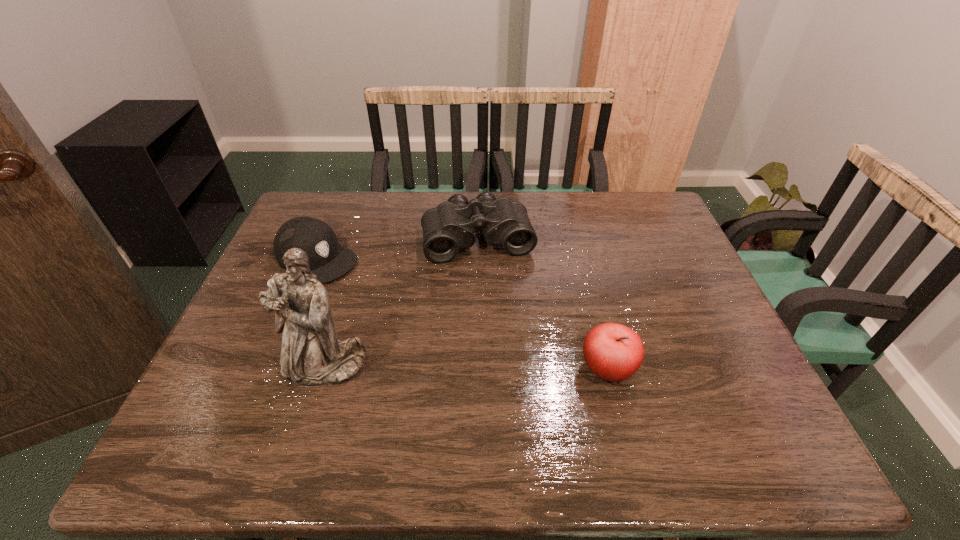
This screenshot has height=540, width=960. Find the location of `free space on the desktop that is between the tallest object and the rightmost object and is positioned on the front-facing side of the cap`. free space on the desktop that is between the tallest object and the rightmost object and is positioned on the front-facing side of the cap is located at coordinates (483, 368).

Find the location of a particular element. free space on the desktop that is between the figurine and the apple and is positioned at the eyepieces of the binoculars is located at coordinates (508, 368).